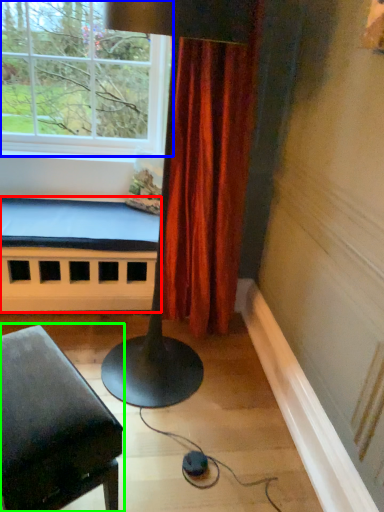
Question: Estimate the real-world distances between objects in this image. Which object is farther from bed frame (highlighted by a red box), window (highlighted by a blue box) or furniture (highlighted by a green box)?

Choices:
 (A) window
 (B) furniture

Answer: (B)